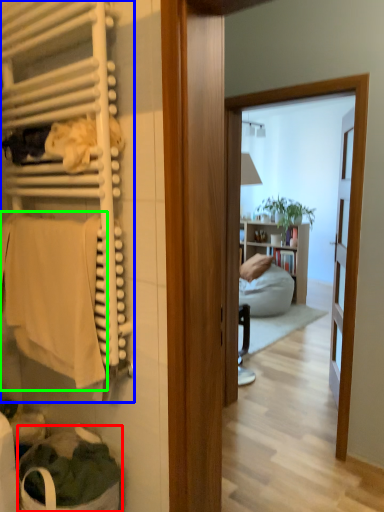
Question: Which object is positioned closest to laundry basket (highlighted by a red box)? Select from closet (highlighted by a blue box) and bath towel (highlighted by a green box).

Choices:
 (A) closet
 (B) bath towel

Answer: (B)